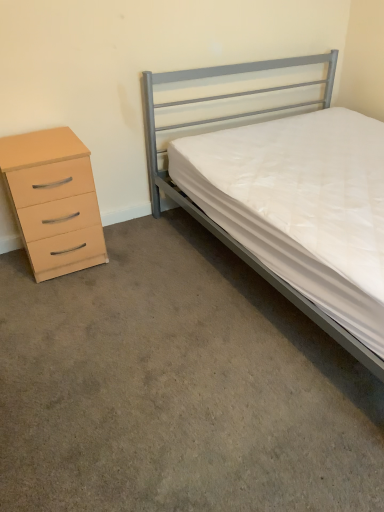
Measure the distance between point [4,170] and camera.

1.86 meters.

The width and height of the screenshot is (384, 512). What do you see at coordinates (212, 220) in the screenshot?
I see `metallic gray bed at right` at bounding box center [212, 220].

Locate an element on the screen. This screenshot has height=512, width=384. beige matte chest of drawers at left is located at coordinates (53, 201).

Considering the points (29, 250) and (166, 407), which point is in front, point (29, 250) or point (166, 407)?

The point (166, 407) is closer to the camera.

Looking at their sizes, would you say beige matte chest of drawers at left is wider or thinner than carpet at lower left?

beige matte chest of drawers at left is thinner than carpet at lower left.

Is beige matte chest of drawers at left positioned beyond the bounds of carpet at lower left?

Indeed, beige matte chest of drawers at left is completely outside carpet at lower left.

From a real-world perspective, who is located lower, beige matte chest of drawers at left or carpet at lower left?

From a 3D spatial view, carpet at lower left is below.

Is metallic gray bed at right touching beige matte chest of drawers at left?

No, metallic gray bed at right is not next to beige matte chest of drawers at left.

Does metallic gray bed at right have a greater height compared to beige matte chest of drawers at left?

Indeed, metallic gray bed at right has a greater height compared to beige matte chest of drawers at left.

Is point (237, 243) farther from camera compared to point (20, 181)?

Yes, point (237, 243) is farther from viewer.

Considering the positions of points (34, 175) and (260, 272), is point (34, 175) closer to camera compared to point (260, 272)?

No, (34, 175) is behind (260, 272).

The width and height of the screenshot is (384, 512). I want to click on bed in front of the beige matte chest of drawers at left, so click(212, 220).

Is beige matte chest of drawers at left oriented away from metallic gray bed at right?

No, metallic gray bed at right is not at the back of beige matte chest of drawers at left.

Does carpet at lower left contain beige matte chest of drawers at left?

No, beige matte chest of drawers at left is not surrounded by carpet at lower left.

Does carpet at lower left have a lesser height compared to beige matte chest of drawers at left?

Yes.

From the image's perspective, is carpet at lower left positioned above or below beige matte chest of drawers at left?

carpet at lower left is situated lower than beige matte chest of drawers at left in the image.

Is point (332, 60) closer to camera compared to point (97, 293)?

No, it is behind (97, 293).

From a real-world perspective, which is physically below, metallic gray bed at right or carpet at lower left?

carpet at lower left, from a real-world perspective.

Is metallic gray bed at right looking in the opposite direction of carpet at lower left?

metallic gray bed at right does not have its back to carpet at lower left.

Can we say metallic gray bed at right lies outside carpet at lower left?

Yes.

Is carpet at lower left at the right side of metallic gray bed at right?

No, carpet at lower left is not to the right of metallic gray bed at right.

Considering their positions, is carpet at lower left located in front of or behind metallic gray bed at right?

carpet at lower left is in front of metallic gray bed at right.

Is carpet at lower left situated inside metallic gray bed at right or outside?

carpet at lower left is not enclosed by metallic gray bed at right.

The image size is (384, 512). In order to click on concrete located underneath the metallic gray bed at right (from a real-world perspective) in this screenshot , I will do `click(177, 387)`.

Image resolution: width=384 pixels, height=512 pixels. Find the location of `concrete below the beige matte chest of drawers at left (from a real-world perspective)`. concrete below the beige matte chest of drawers at left (from a real-world perspective) is located at coordinates (177, 387).

Where is `bed lying in front of the beige matte chest of drawers at left`? The width and height of the screenshot is (384, 512). bed lying in front of the beige matte chest of drawers at left is located at coordinates (212, 220).

From the image, which object appears to be farther from metallic gray bed at right, beige matte chest of drawers at left or carpet at lower left?

carpet at lower left.

Considering their positions, is beige matte chest of drawers at left positioned further to carpet at lower left than metallic gray bed at right?

metallic gray bed at right is further to carpet at lower left.

When comparing their distances from carpet at lower left, does metallic gray bed at right or beige matte chest of drawers at left seem further?

metallic gray bed at right lies further to carpet at lower left than the other object.

Considering their positions, is metallic gray bed at right positioned closer to beige matte chest of drawers at left than carpet at lower left?

carpet at lower left lies closer to beige matte chest of drawers at left than the other object.

When comparing their distances from metallic gray bed at right, does carpet at lower left or beige matte chest of drawers at left seem further?

The object further to metallic gray bed at right is carpet at lower left.

Estimate the real-world distances between objects in this image. Which object is closer to beige matte chest of drawers at left, carpet at lower left or metallic gray bed at right?

Among the two, carpet at lower left is located nearer to beige matte chest of drawers at left.

Identify the location of concrete between beige matte chest of drawers at left and metallic gray bed at right. The width and height of the screenshot is (384, 512). (177, 387).